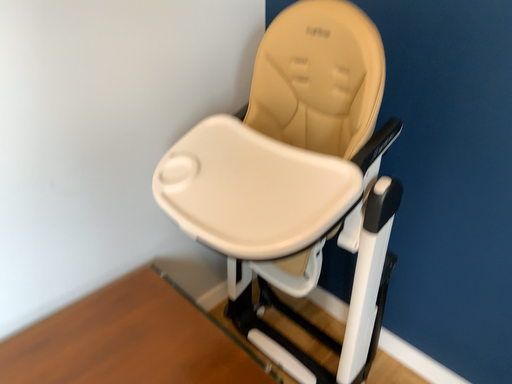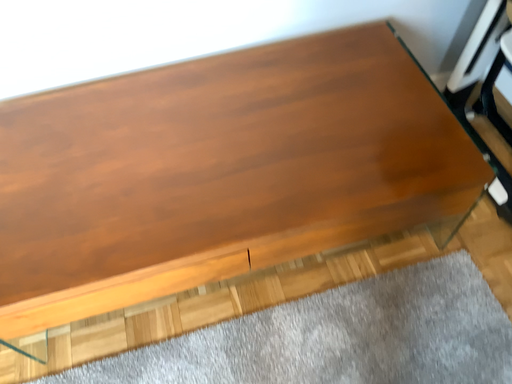
Question: How did the camera likely rotate when shooting the video?

Choices:
 (A) rotated right
 (B) rotated left

Answer: (B)